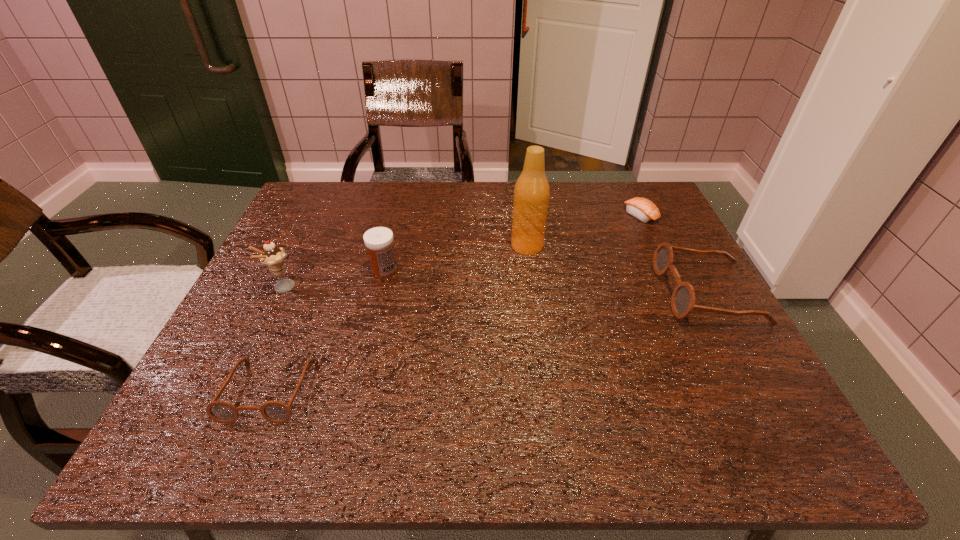
Where is `spectacles that is at the left edge`? The image size is (960, 540). spectacles that is at the left edge is located at coordinates coord(277,412).

I want to click on icecream present at the left edge, so (273, 257).

Locate an element on the screen. spectacles positioned at the right edge is located at coordinates (683, 298).

This screenshot has height=540, width=960. Find the location of `sushi situated at the right edge`. sushi situated at the right edge is located at coordinates click(x=643, y=209).

Identify the location of object located at the near left corner. (277, 412).

Identify the location of object that is at the far right corner. Image resolution: width=960 pixels, height=540 pixels. (643, 209).

Find the location of a particular element. vacant space at the far edge is located at coordinates (363, 208).

In the image, there is a desktop. Identify the location of blank space at the near edge. This screenshot has height=540, width=960. (345, 383).

At what (x,y) coordinates should I click in order to perform the action: click on vacant space at the right edge of the desktop. Please return your answer as a coordinate pair (x, y). The height and width of the screenshot is (540, 960). Looking at the image, I should click on (654, 244).

In order to click on vacant space at the far left corner of the desktop in this screenshot , I will do `click(345, 220)`.